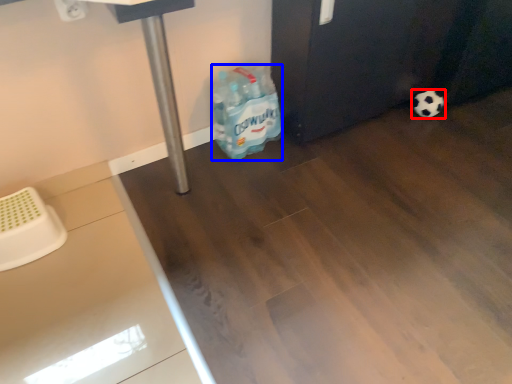
Question: Among these objects, which one is farthest to the camera, football (highlighted by a red box) or cleaning product (highlighted by a blue box)?

Choices:
 (A) football
 (B) cleaning product

Answer: (A)